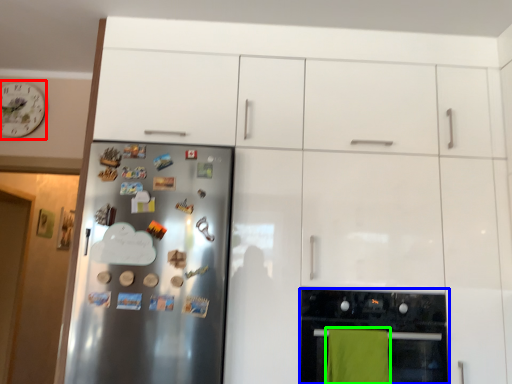
Question: Which is nearer to the clock (highlighted by a red box)? home appliance (highlighted by a blue box) or beach towel (highlighted by a green box).

Choices:
 (A) home appliance
 (B) beach towel

Answer: (A)